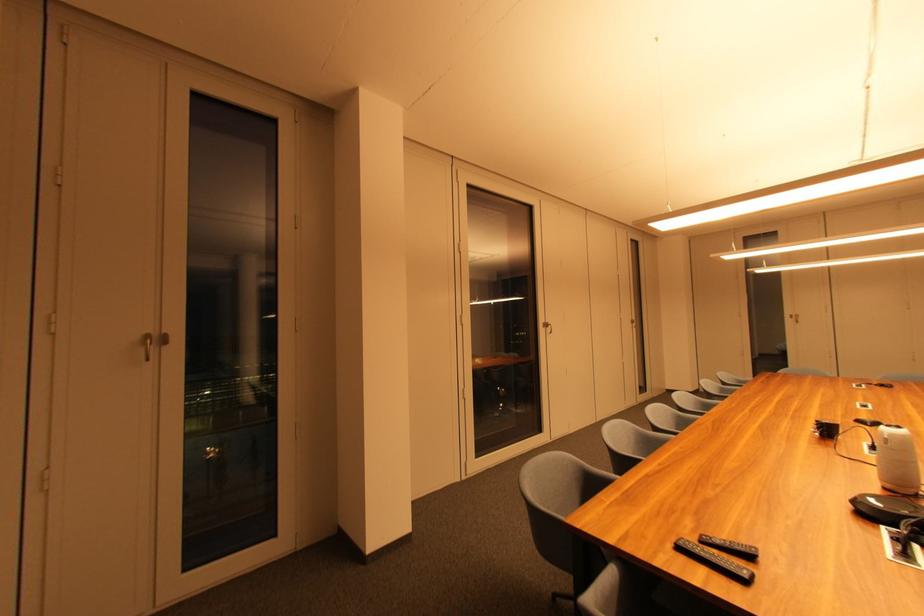
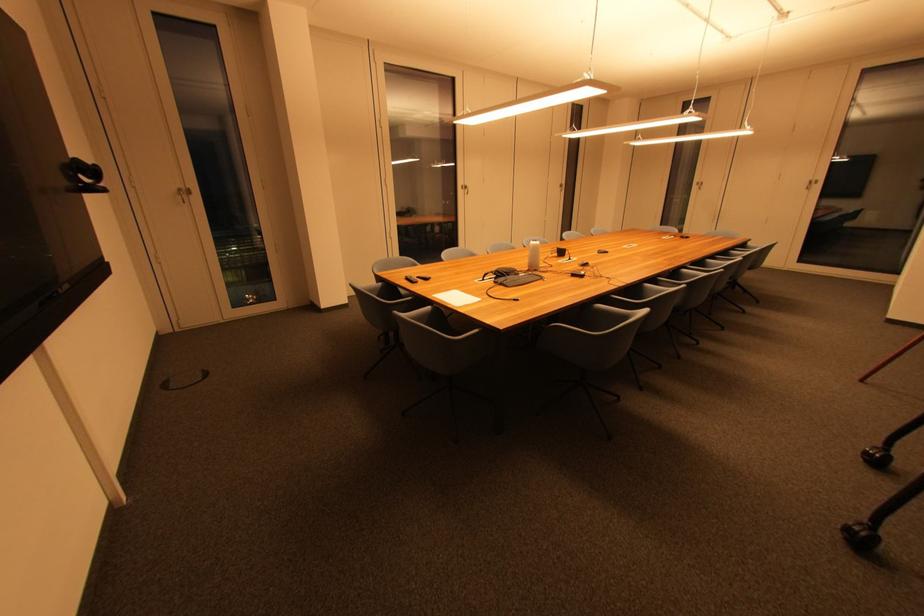
Locate, in the second image, the point that corresponds to point (152, 339) in the first image.

(185, 192)